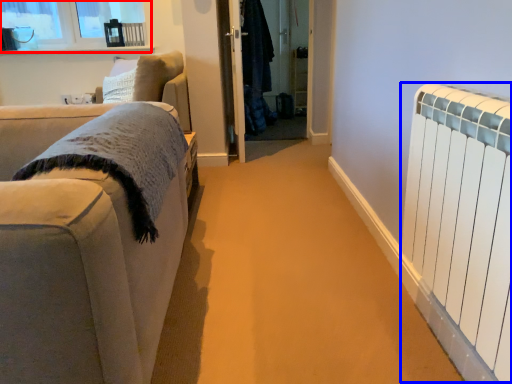
Question: Which point is further to the camera, window (highlighted by a red box) or radiator (highlighted by a blue box)?

Choices:
 (A) window
 (B) radiator

Answer: (A)